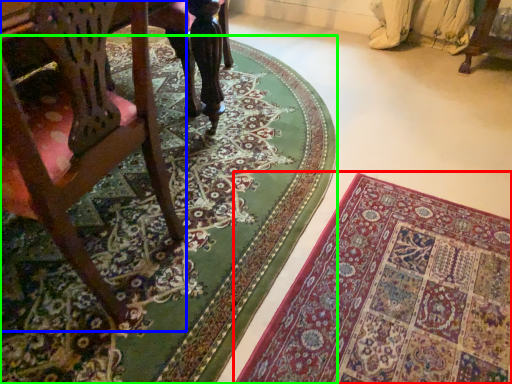
Question: Based on their relative distances, which object is nearer to mat (highlighted by a red box)? Choose from chair (highlighted by a blue box) and mat (highlighted by a green box).

Choices:
 (A) chair
 (B) mat

Answer: (B)